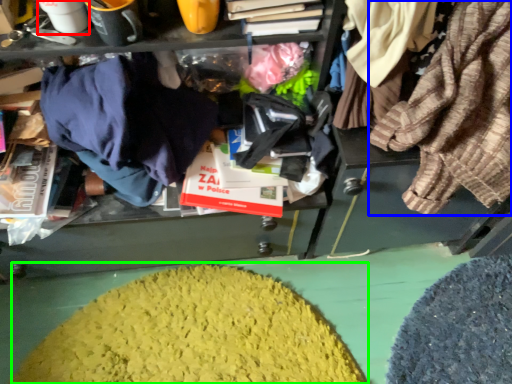
Question: Considering the real-world distances, which object is closest to coffee cup (highlighted by a red box)? clothing (highlighted by a blue box) or debris (highlighted by a green box).

Choices:
 (A) clothing
 (B) debris

Answer: (A)